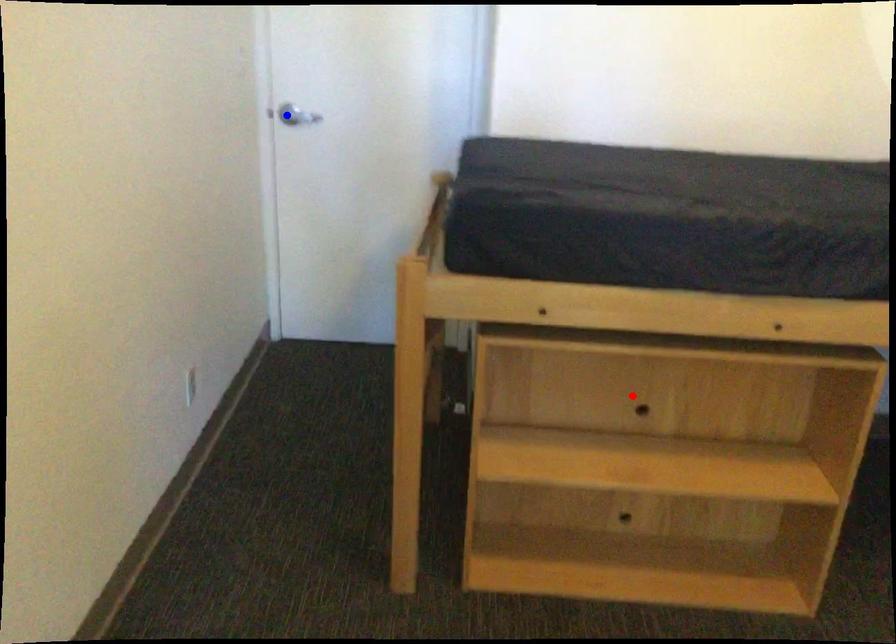
Question: Two points are marked on the image. Which point is closer to the camera?

Choices:
 (A) Blue point is closer.
 (B) Red point is closer.

Answer: (B)